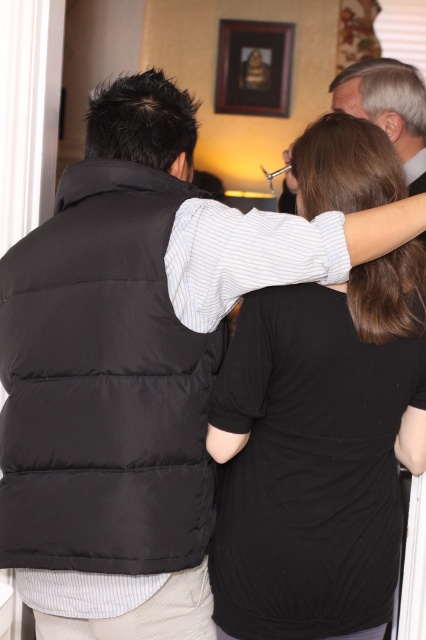
Image resolution: width=426 pixels, height=640 pixels. I want to click on black matte shirt at upper center, so click(316, 451).

Is point (219, 371) positioned after point (123, 381)?

Yes, point (219, 371) is farther from viewer.

Identify the location of black matte shirt at upper center. (316, 451).

Is black matte shirt at upper center smaller than wooden picture frame at upper center?

No, black matte shirt at upper center is not smaller than wooden picture frame at upper center.

Who is more distant from viewer, (252,621) or (279,60)?

The point (279,60) is behind.

Is point (307, 589) in front of point (221, 28)?

Yes, point (307, 589) is closer to viewer.

What are the coordinates of `black matte shirt at upper center` in the screenshot? It's located at 316,451.

Is black puffer vest at center taller than wooden picture frame at upper center?

Indeed, black puffer vest at center has a greater height compared to wooden picture frame at upper center.

Between black puffer vest at center and wooden picture frame at upper center, which one has more height?

With more height is black puffer vest at center.

Who is more distant from viewer, (x=146, y=552) or (x=224, y=100)?

The point (x=224, y=100) is more distant.

Where is `black puffer vest at center`? black puffer vest at center is located at coordinates (103, 385).